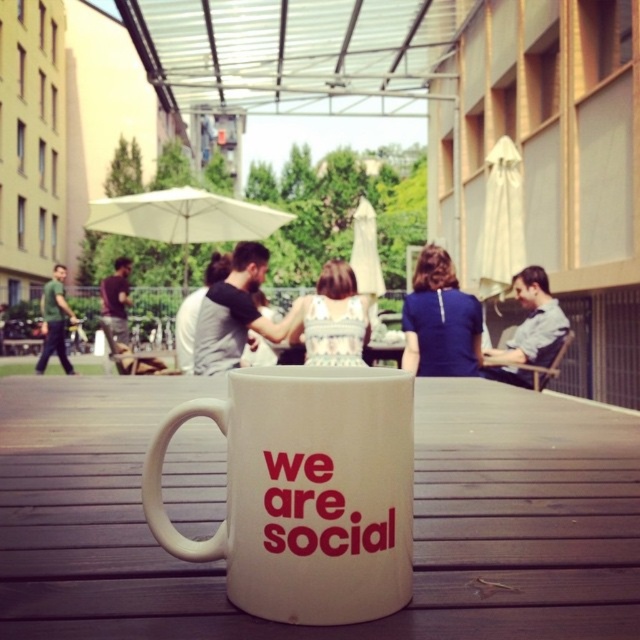
Question: Is light blue shirt at center closer to camera compared to dark gray sweater at center?

Choices:
 (A) yes
 (B) no

Answer: (A)

Question: Which point is farther from the camera taking this photo?

Choices:
 (A) (38, 356)
 (B) (216, 285)
 (C) (436, 276)

Answer: (A)

Question: Which point is closer to the camera?

Choices:
 (A) white ceramic mug at center
 (B) white wooden table at center
 (C) dark gray sweater at center

Answer: (B)

Question: Is white fabric shirt at center closer to camera compared to dark gray sweater at center?

Choices:
 (A) no
 (B) yes

Answer: (B)

Question: Does blue fabric shirt at center appear on the right side of dark gray sweater at center?

Choices:
 (A) yes
 (B) no

Answer: (A)

Question: Which point is farther to the camera?

Choices:
 (A) (465, 358)
 (B) (51, 316)
 (C) (193, 544)

Answer: (B)